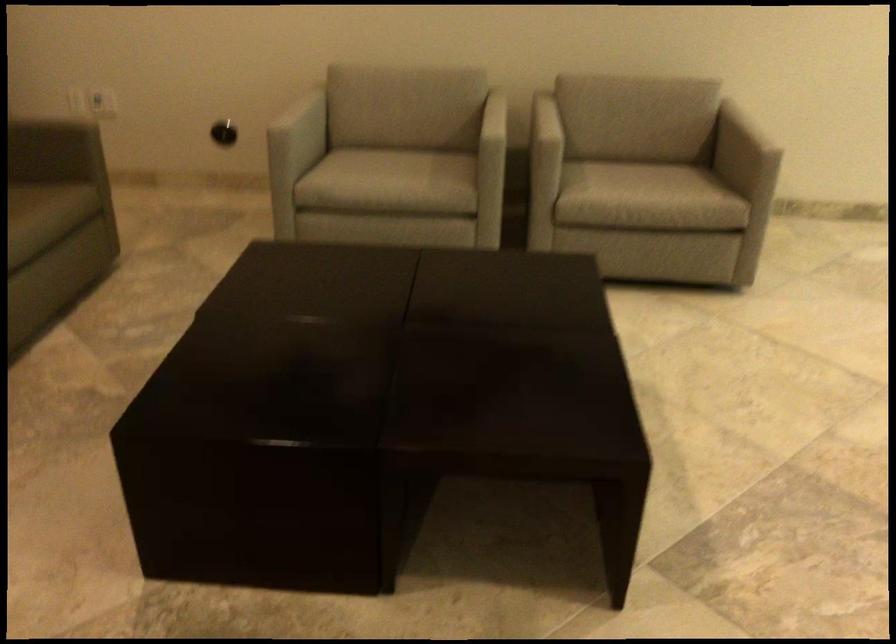
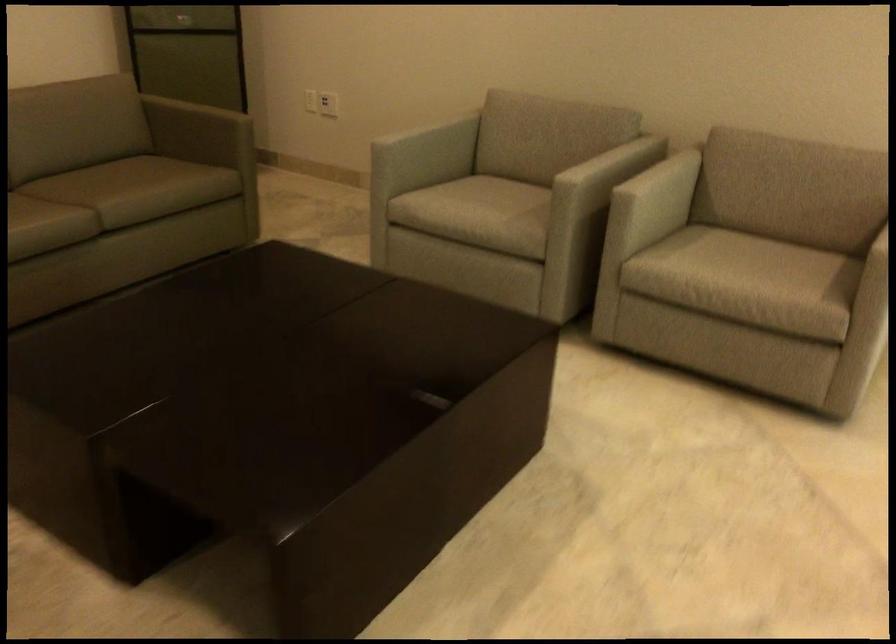
Find the pixel in the second image that matches point (114, 99) in the first image.

(328, 104)